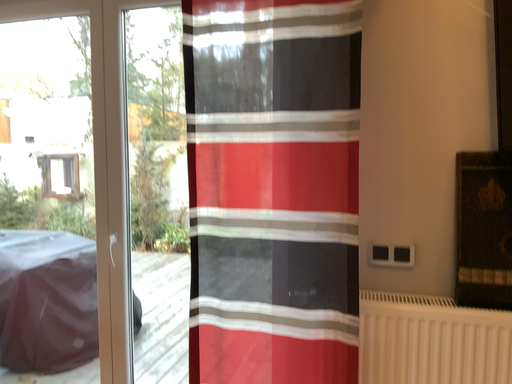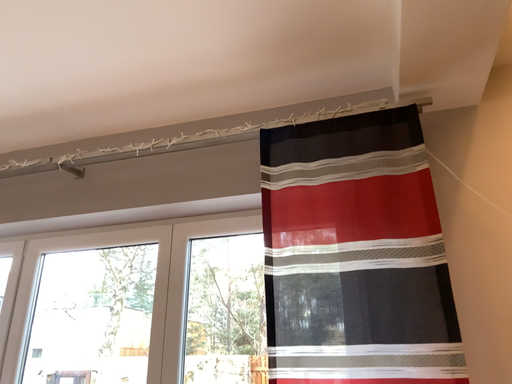
Question: How did the camera likely rotate when shooting the video?

Choices:
 (A) rotated downward
 (B) rotated upward

Answer: (B)